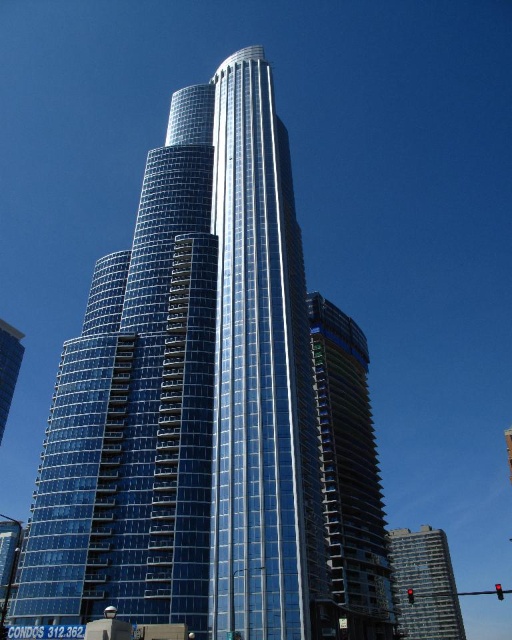
Is transparent glass building at center to the right of clear glass building at lower right from the viewer's perspective?

No, transparent glass building at center is not to the right of clear glass building at lower right.

Which is behind, point (256, 140) or point (437, 538)?

The point (437, 538) is more distant.

Is point (82, 461) behind point (415, 564)?

No, it is not.

Locate an element on the screen. This screenshot has height=640, width=512. transparent glass building at center is located at coordinates (210, 410).